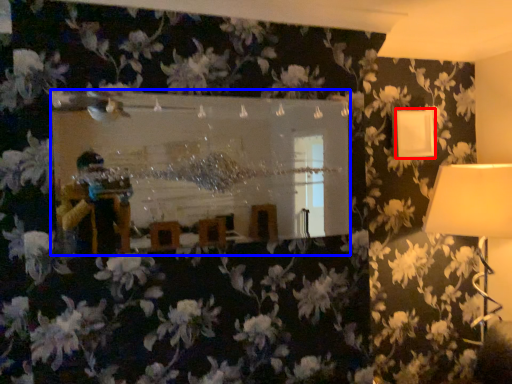
Question: Among these objects, which one is farthest to the camera, lamp (highlighted by a red box) or mirror (highlighted by a blue box)?

Choices:
 (A) lamp
 (B) mirror

Answer: (A)